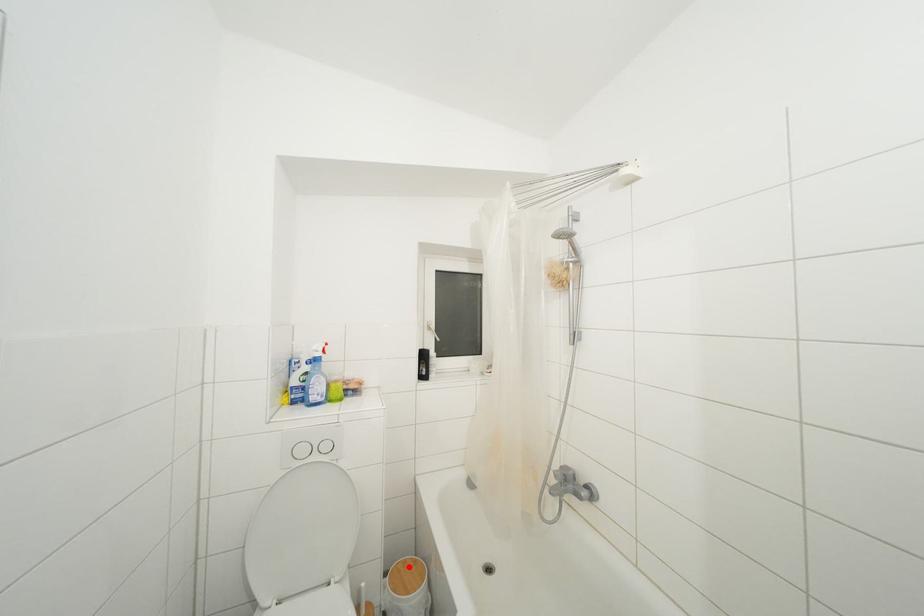
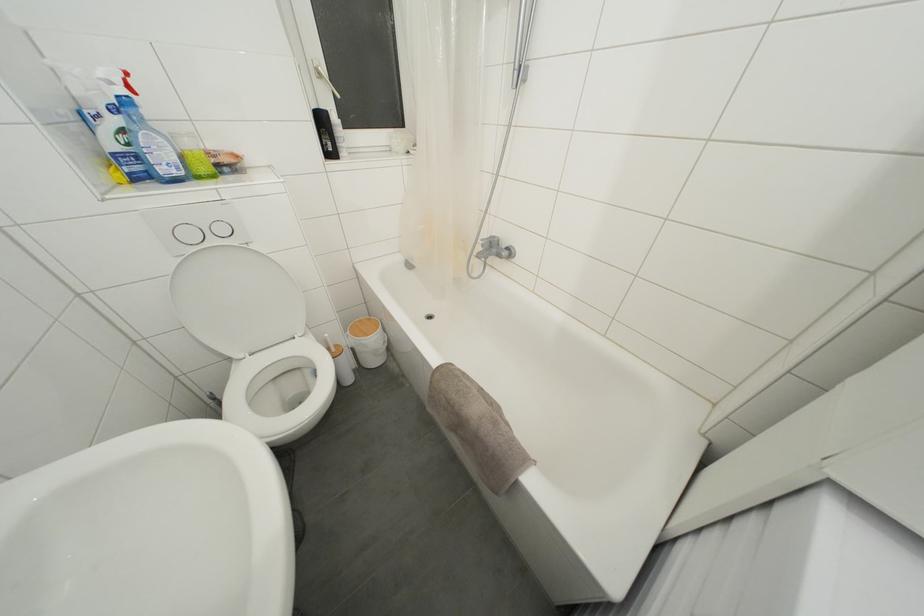
Question: I am providing you with two images of the same scene from different viewpoints. A red point is marked on the first image. Can you still see the location of the red point in image 2?

Choices:
 (A) Yes
 (B) No

Answer: (A)